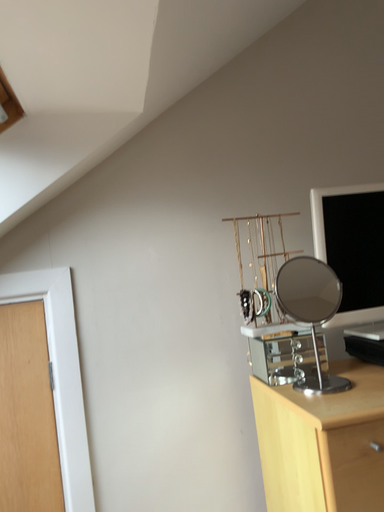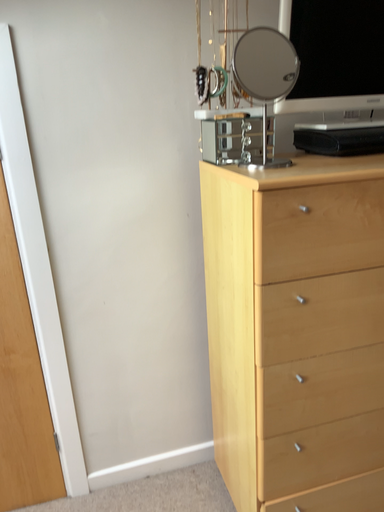
Question: How did the camera likely rotate when shooting the video?

Choices:
 (A) rotated upward
 (B) rotated downward

Answer: (B)